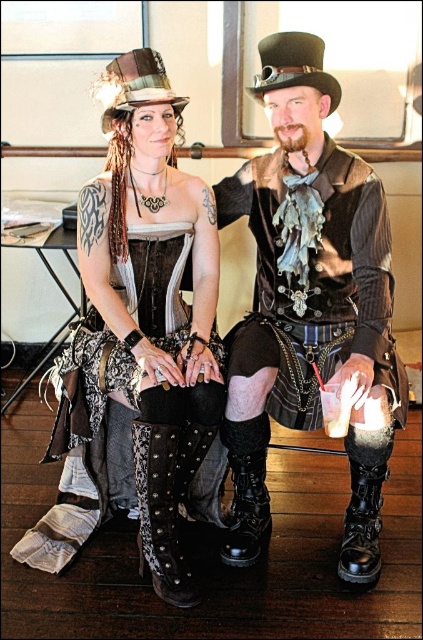
Is shiny leather vest at center taller than suede studded boot at lower center?

Yes, shiny leather vest at center is taller than suede studded boot at lower center.

Can you confirm if shiny leather vest at center is shorter than suede studded boot at lower center?

In fact, shiny leather vest at center may be taller than suede studded boot at lower center.

Is point (310, 259) positioned after point (153, 520)?

Yes, point (310, 259) is behind point (153, 520).

Locate an element on the screen. shiny leather vest at center is located at coordinates (308, 301).

Is point (381, 280) closer to camera compared to point (172, 449)?

No, (381, 280) is behind (172, 449).

Which is more to the left, shiny leather vest at center or leather boots at center?

Positioned to the left is leather boots at center.

Identify the location of shiny leather vest at center. (308, 301).

Can you confirm if leather boots at center is wider than black leather boot at center?

Correct, the width of leather boots at center exceeds that of black leather boot at center.

Does point (80, 221) come in front of point (255, 500)?

That is True.

Is point (118, 90) more distant than point (264, 490)?

No, (118, 90) is in front of (264, 490).

Locate an element on the screen. Image resolution: width=423 pixels, height=640 pixels. leather boots at center is located at coordinates (147, 310).